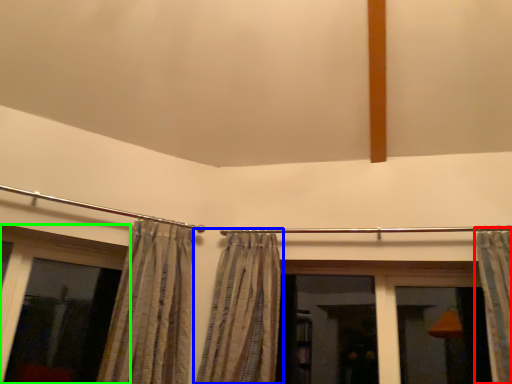
Question: Which object is the farthest from curtain (highlighted by a red box)? Choose among these: curtain (highlighted by a blue box) or window (highlighted by a green box).

Choices:
 (A) curtain
 (B) window

Answer: (B)